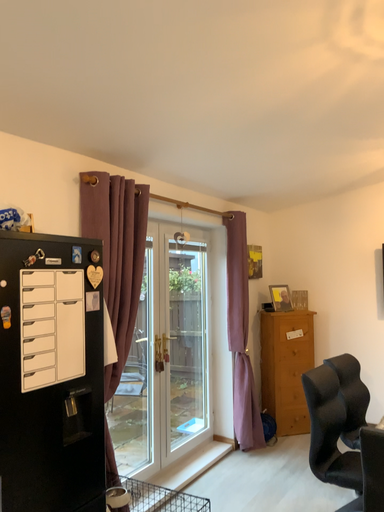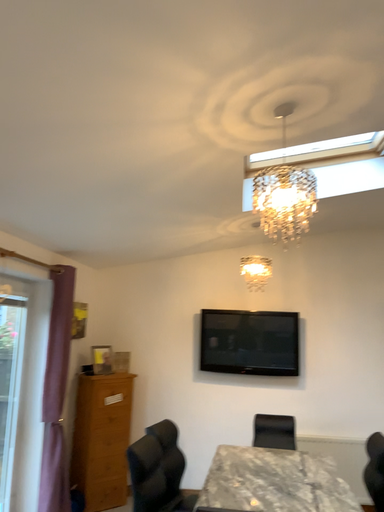
Question: How did the camera likely rotate when shooting the video?

Choices:
 (A) rotated right
 (B) rotated left

Answer: (A)